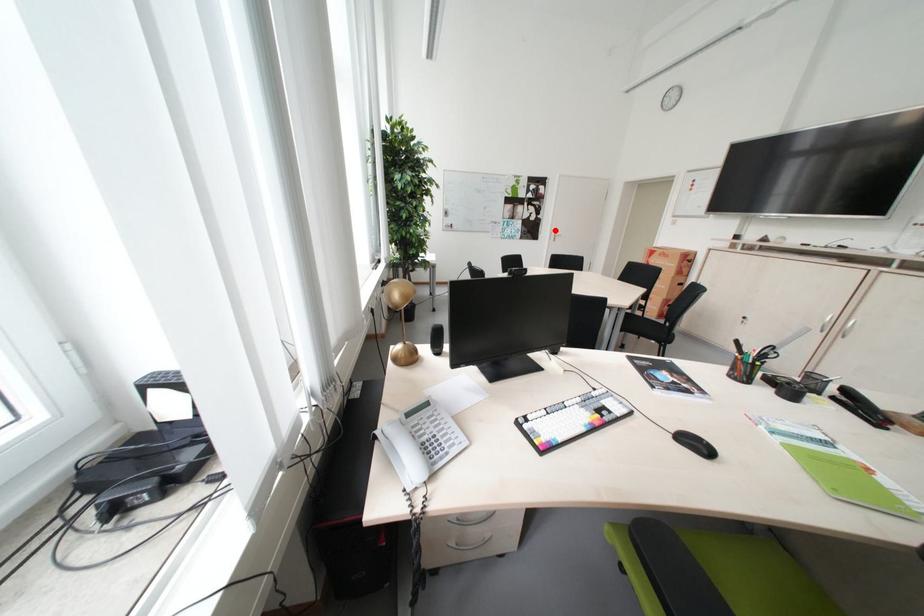
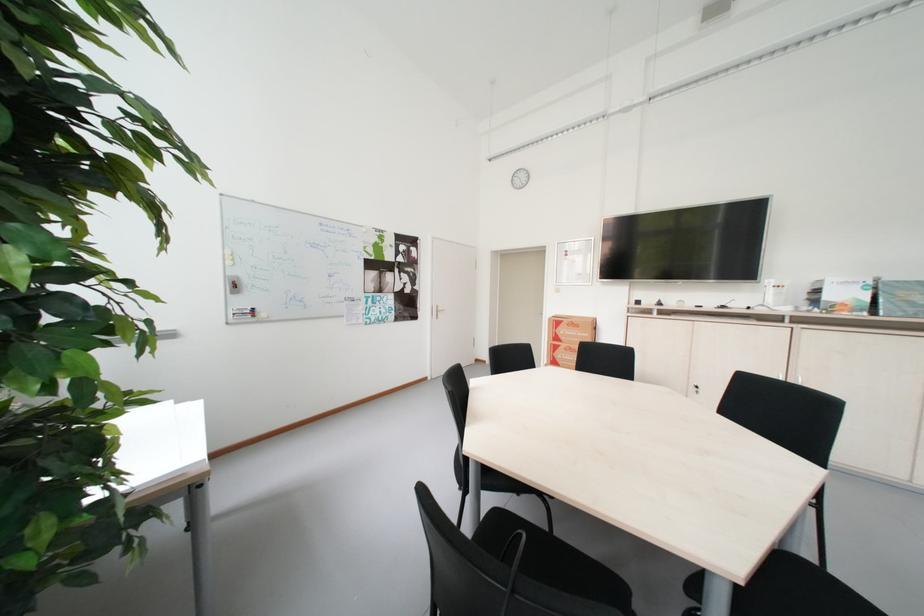
Question: I am providing you with two images of the same scene from different viewpoints. A red point is shown in image1. For the corresponding object point in image2, is it positioned nearer or farther from the camera?

Choices:
 (A) Nearer
 (B) Farther

Answer: (B)